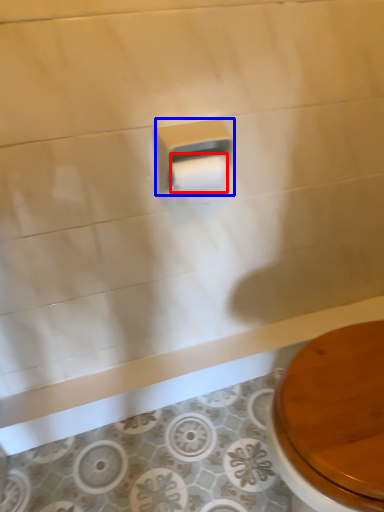
Question: Which of the following is the farthest to the observer, toilet paper (highlighted by a red box) or toilet paper (highlighted by a blue box)?

Choices:
 (A) toilet paper
 (B) toilet paper

Answer: (A)